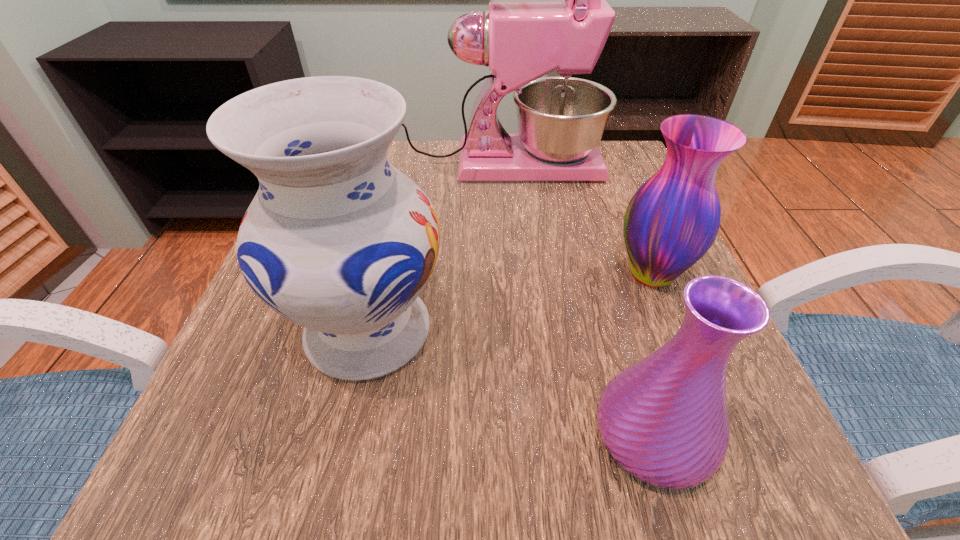
Where is `mixer`? This screenshot has width=960, height=540. mixer is located at coordinates (561, 120).

The height and width of the screenshot is (540, 960). Find the location of `the leftmost vase`. the leftmost vase is located at coordinates [337, 240].

Locate an element on the screen. blank area located on the face of the farthest object is located at coordinates (622, 165).

You are a GUI agent. You are given a task and a screenshot of the screen. Output one action in this format:
    pyautogui.click(x=<x>, y=<y>)
    Task: Click on the vacant space located on the front of the tallest vase
    
    Given the screenshot: What is the action you would take?
    (x=328, y=503)

Where is `object at the far edge`? object at the far edge is located at coordinates (561, 120).

You are a GUI agent. You are given a task and a screenshot of the screen. Output one action in this format:
    pyautogui.click(x=<x>, y=<y>)
    Task: Click on the object that is at the near edge
    The width and height of the screenshot is (960, 540).
    Given the screenshot: What is the action you would take?
    (x=664, y=419)

Where is `object at the left edge`? The width and height of the screenshot is (960, 540). object at the left edge is located at coordinates (x=337, y=240).

What are the coordinates of `mixer positioned at the right edge` in the screenshot? It's located at (561, 120).

Find the location of a particular element. object at the far right corner is located at coordinates (561, 120).

Where is `object that is at the near right corner`? object that is at the near right corner is located at coordinates (664, 419).